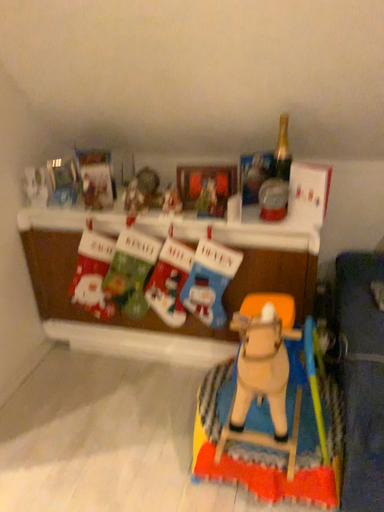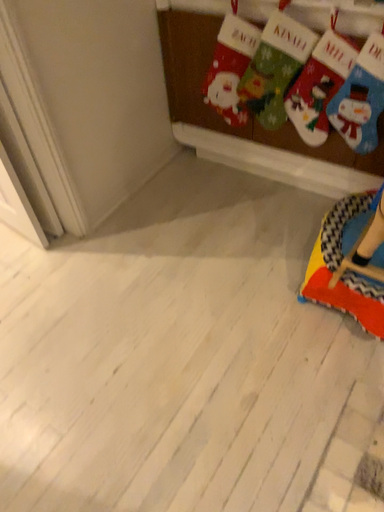
Question: How did the camera likely rotate when shooting the video?

Choices:
 (A) rotated downward
 (B) rotated upward

Answer: (A)